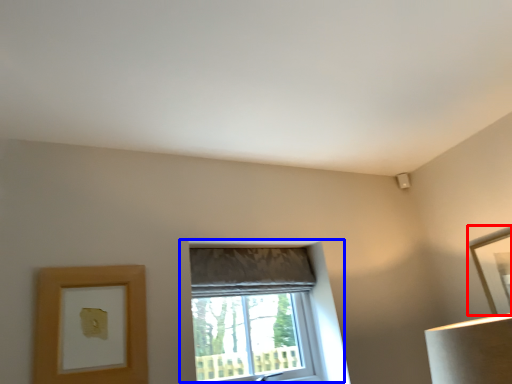
Question: Which of the following is the closest to the observer, picture frame (highlighted by a red box) or window (highlighted by a blue box)?

Choices:
 (A) picture frame
 (B) window

Answer: (B)